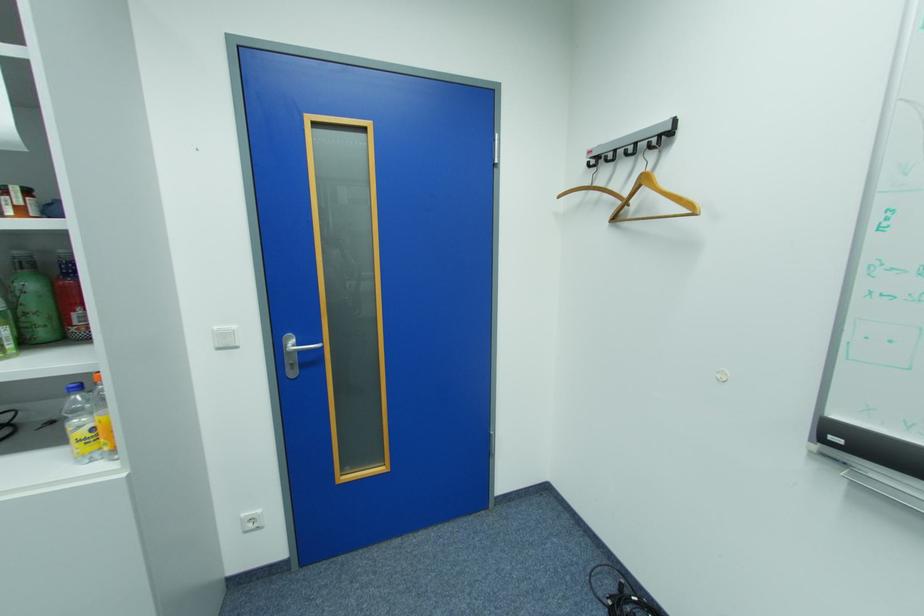
The width and height of the screenshot is (924, 616). What do you see at coordinates (251, 521) in the screenshot? I see `the white light switch` at bounding box center [251, 521].